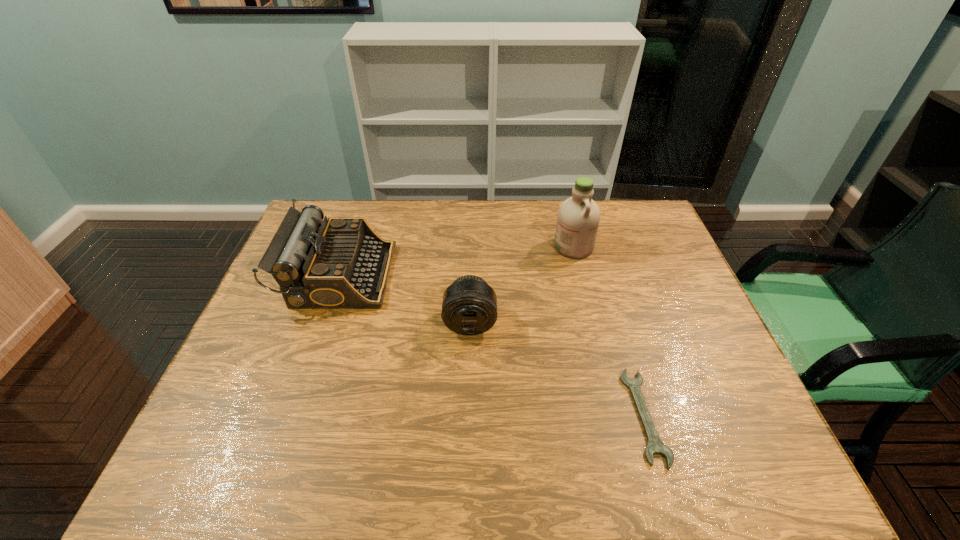
Find the location of a particular element. This screenshot has width=960, height=540. cleansing agent is located at coordinates (578, 218).

The image size is (960, 540). Find the location of `the third shortest object`. the third shortest object is located at coordinates (341, 263).

Image resolution: width=960 pixels, height=540 pixels. I want to click on typewriter, so click(x=341, y=263).

Image resolution: width=960 pixels, height=540 pixels. Identify the location of telephoto lens. (469, 307).

Locate an element on the screen. the second object from left to right is located at coordinates (469, 307).

Identify the location of wrench. This screenshot has width=960, height=540. (655, 446).

The height and width of the screenshot is (540, 960). I want to click on the shortest object, so click(x=655, y=446).

Locate an element on the screen. Image resolution: width=960 pixels, height=540 pixels. free location located 0.350m on the front label of the tallest object is located at coordinates (446, 246).

Find the location of a particular element. vacant space positioned 0.320m on the front label of the tallest object is located at coordinates (455, 246).

This screenshot has height=540, width=960. What are the coordinates of `vacant space located 0.250m on the front label of the tallest object` in the screenshot? It's located at (477, 246).